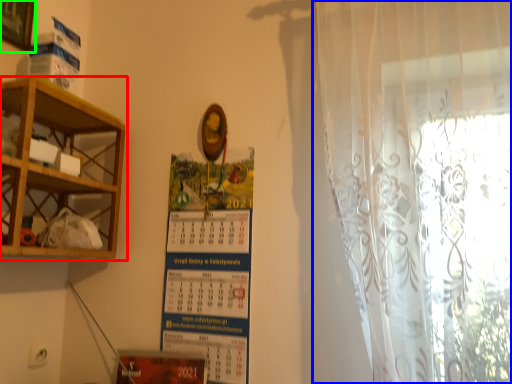
Question: Which object is positioned closest to shelf (highlighted by a red box)? Select from curtain (highlighted by a blue box) and picture frame (highlighted by a green box).

Choices:
 (A) curtain
 (B) picture frame

Answer: (B)